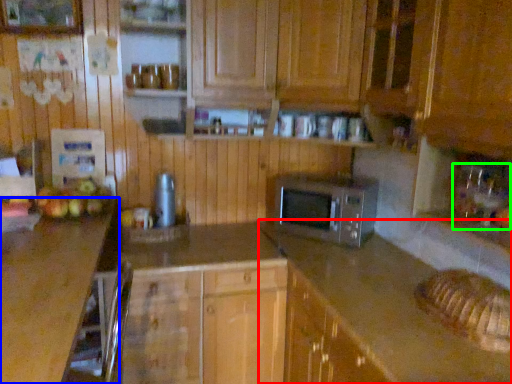
Question: Which is farther away from counter (highlighted by a red box)? countertop (highlighted by a blue box) or sink (highlighted by a green box)?

Choices:
 (A) countertop
 (B) sink

Answer: (A)